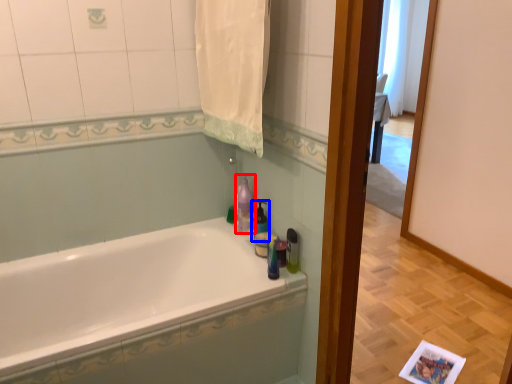
Question: Which of the following is the closest to the observer, cleaning product (highlighted by a red box) or soap dispenser (highlighted by a blue box)?

Choices:
 (A) cleaning product
 (B) soap dispenser

Answer: (B)